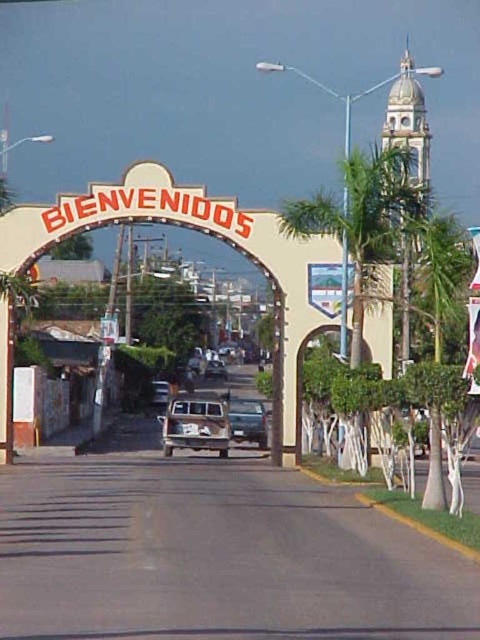
Question: Does metallic silver car at center appear on the left side of matte black truck at center?

Choices:
 (A) no
 (B) yes

Answer: (A)

Question: Which point is closer to the camera?

Choices:
 (A) matte black truck at center
 (B) green leafy palm tree at right

Answer: (B)

Question: Which point is farther to the camera?

Choices:
 (A) (178, 424)
 (B) (153, 394)
 (C) (328, 221)

Answer: (B)

Question: From the image, what is the correct spatial relationship of green leafy palm tree at right in relation to matte black truck at center?

Choices:
 (A) left
 (B) right

Answer: (B)

Question: Based on their relative distances, which object is farther from the matte black truck at center?

Choices:
 (A) metallic silver truck at center
 (B) rusty metal van at center
 (C) metallic silver car at center

Answer: (B)

Question: Is rusty metal van at center closer to camera compared to metallic silver car at center?

Choices:
 (A) yes
 (B) no

Answer: (A)